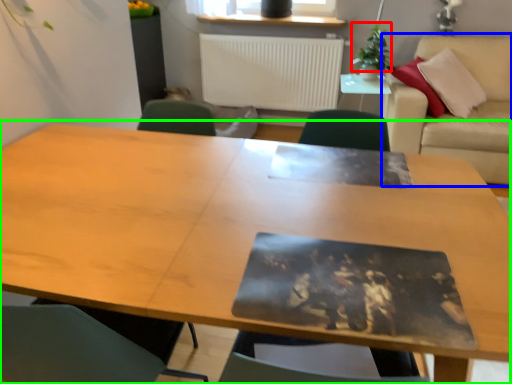
Question: Based on their relative distances, which object is farther from plant (highlighted by a red box)? Choose from couch (highlighted by a blue box) and table (highlighted by a green box).

Choices:
 (A) couch
 (B) table

Answer: (B)